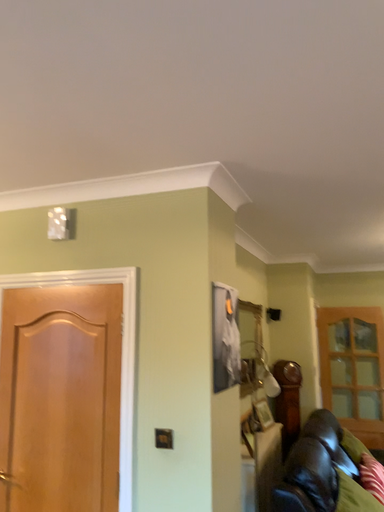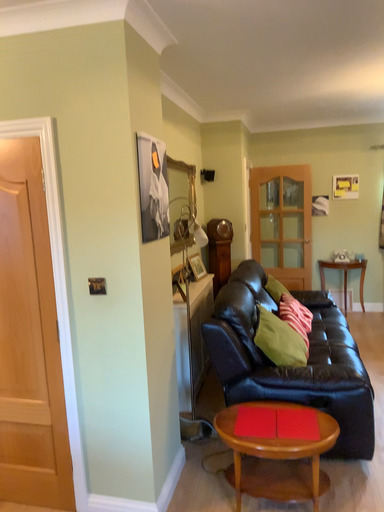
Question: Which way did the camera rotate in the video?

Choices:
 (A) rotated right
 (B) rotated left

Answer: (A)